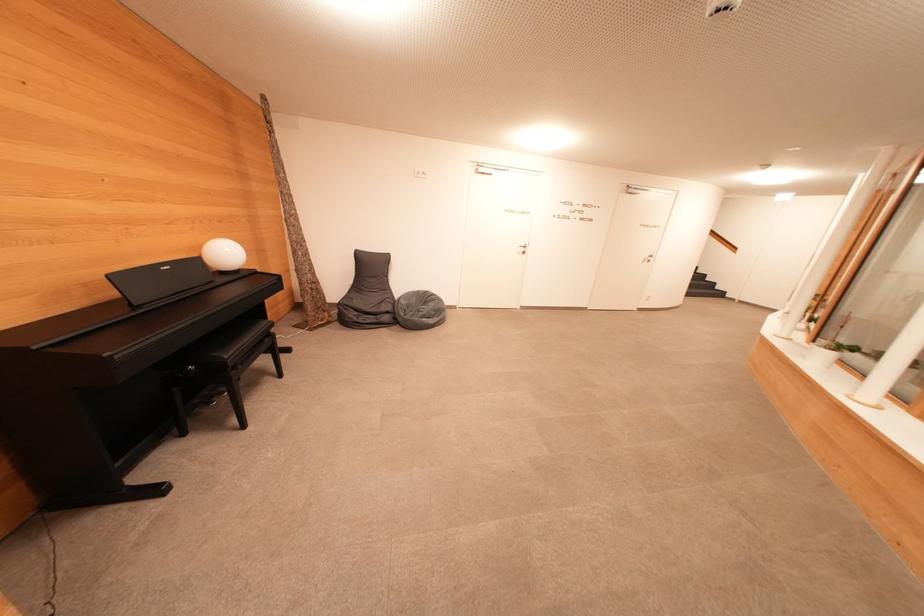
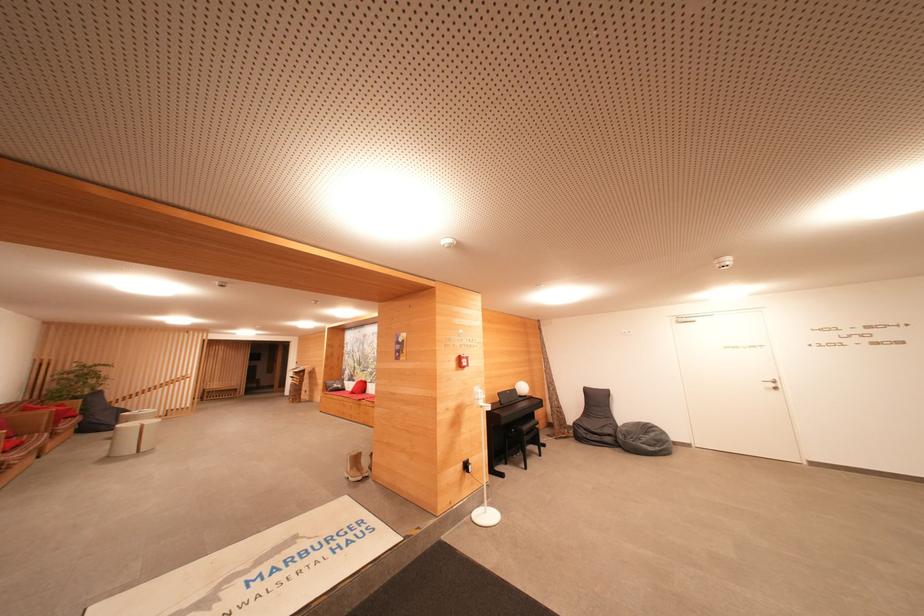
Where in the second image is the point corresponding to the point at 434,307 from the first image?

(655, 438)